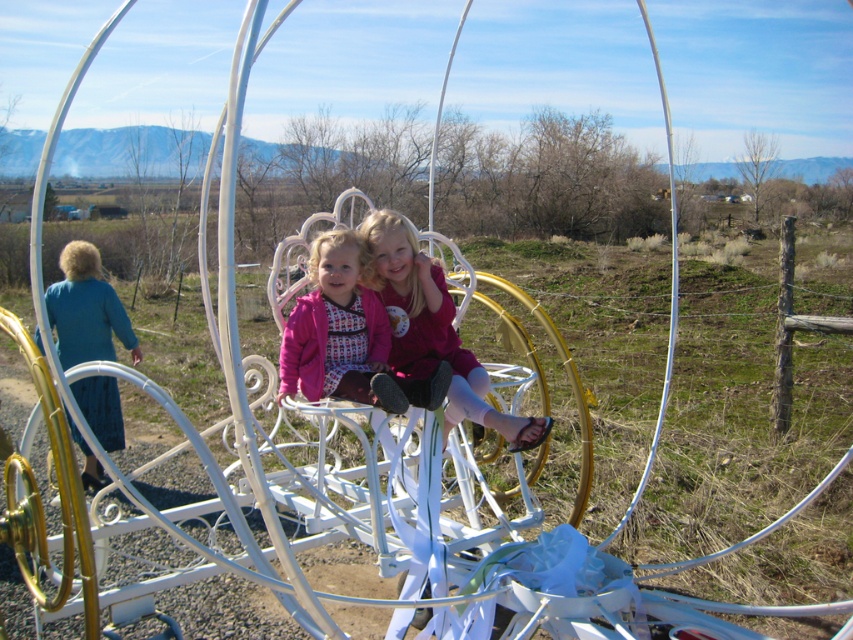
You are a photographer trying to capture a clear shot of both the matte pink dress at center and the matte pink jacket at center. Since the camera can only focus on one object at a time, which one should you choose to ensure the taller object is in focus?

The matte pink dress at center is much taller than the matte pink jacket at center, so you should focus on the matte pink dress at center to ensure the taller object is in focus.

You are standing in front of the carriage and want to place a small flower at each of the two points marked as point [407,292] and point [450,376]. Which point is closer to you so you can place the flower without stretching?

Point [407,292] is closer to you than point [450,376], so you can place the flower there without stretching.